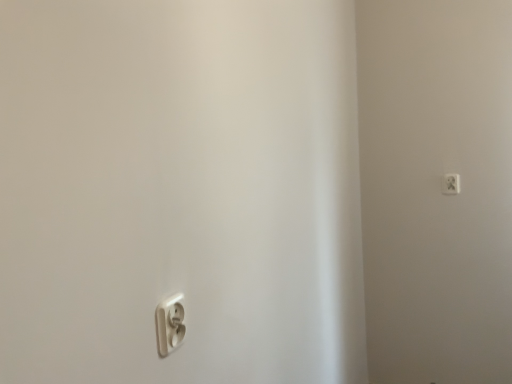
Question: From the image's perspective, is white plastic power plug at upper right, placed as the second power plugs and sockets when sorted from front to back, above or below white plastic power plug at lower left, the 2th power plugs and sockets in the top-to-bottom sequence?

Choices:
 (A) above
 (B) below

Answer: (A)

Question: Is point (448, 192) closer or farther from the camera than point (158, 349)?

Choices:
 (A) closer
 (B) farther

Answer: (B)

Question: Considering the positions of white plastic power plug at upper right, acting as the 1th power plugs and sockets starting from the top, and white plastic power plug at lower left, the 1th power plugs and sockets from the front, in the image, is white plastic power plug at upper right, acting as the 1th power plugs and sockets starting from the top, wider or thinner than white plastic power plug at lower left, the 1th power plugs and sockets from the front,?

Choices:
 (A) thin
 (B) wide

Answer: (A)

Question: Considering the positions of point (159, 352) and point (457, 173), is point (159, 352) closer or farther from the camera than point (457, 173)?

Choices:
 (A) farther
 (B) closer

Answer: (B)

Question: Looking at their shapes, would you say white plastic power plug at lower left, which is counted as the first power plugs and sockets, starting from the bottom, is wider or thinner than white plastic power plug at upper right, the 1th power plugs and sockets when ordered from back to front?

Choices:
 (A) wide
 (B) thin

Answer: (A)

Question: Considering their positions, is white plastic power plug at lower left, the 1th power plugs and sockets from the front, located in front of or behind white plastic power plug at upper right, which is counted as the 2th power plugs and sockets, starting from the left?

Choices:
 (A) front
 (B) behind

Answer: (A)

Question: From a real-world perspective, is white plastic power plug at lower left, the 1th power plugs and sockets from the front, above or below white plastic power plug at upper right, which is counted as the 2th power plugs and sockets, starting from the left?

Choices:
 (A) above
 (B) below

Answer: (B)